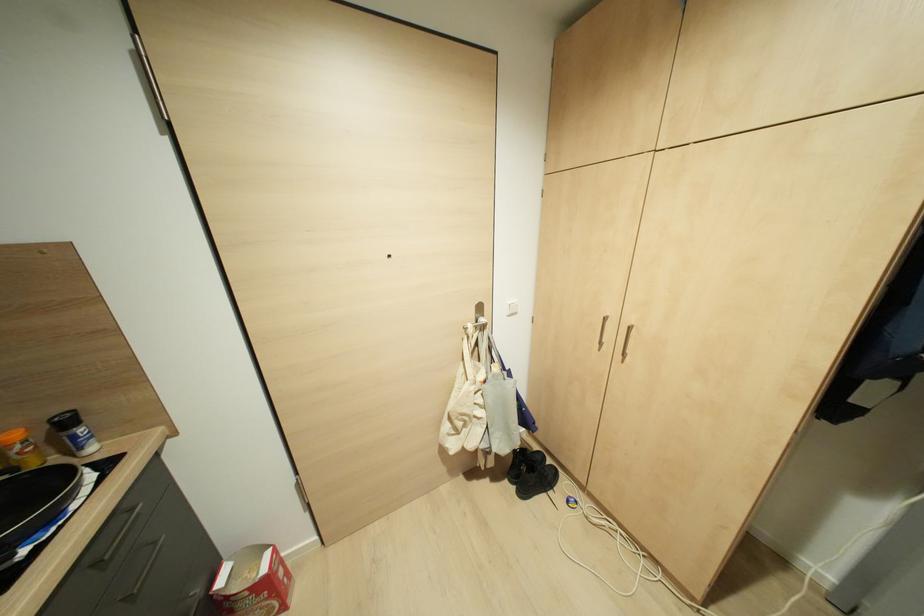
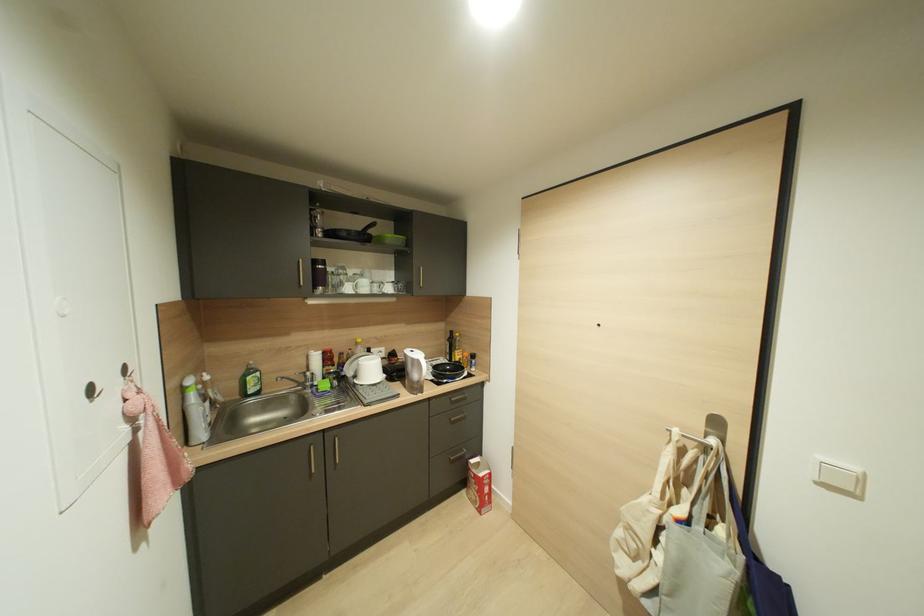
Where in the second image is the point corresponding to the point at 219,583 from the first image?

(470, 460)